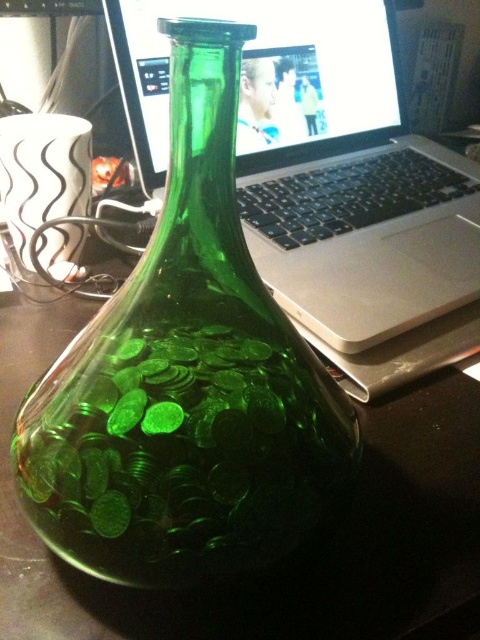
Between green glass vase at center and sleek silver laptop at center, which one appears on the right side from the viewer's perspective?

sleek silver laptop at center

Between point (196, 448) and point (391, 113), which one is positioned in front?

Positioned in front is point (196, 448).

At what (x,y) coordinates should I click in order to perform the action: click on green glass vase at center. Please return your answer as a coordinate pair (x, y). This screenshot has width=480, height=640. Looking at the image, I should click on (184, 380).